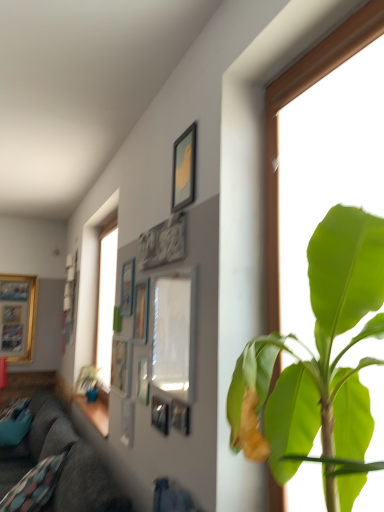
Question: Is matte silver picture frame at center, the sixth picture frame positioned from the front, taller than matte silver picture frame at center, the ninth picture frame in the front-to-back sequence?

Choices:
 (A) yes
 (B) no

Answer: (B)

Question: Is matte silver picture frame at center, the 7th picture frame from the back, placed right next to matte silver picture frame at center, the ninth picture frame in the front-to-back sequence?

Choices:
 (A) no
 (B) yes

Answer: (A)

Question: Is matte silver picture frame at center, the sixth picture frame positioned from the front, far from matte silver picture frame at center, the 4th picture frame from the back?

Choices:
 (A) no
 (B) yes

Answer: (A)

Question: From the image's perspective, is matte silver picture frame at center, the 6th picture frame positioned from the right, over matte silver picture frame at center, the third picture frame from the left?

Choices:
 (A) no
 (B) yes

Answer: (B)

Question: From a real-world perspective, is matte silver picture frame at center, the 6th picture frame positioned from the right, on top of matte silver picture frame at center, the ninth picture frame in the front-to-back sequence?

Choices:
 (A) no
 (B) yes

Answer: (A)

Question: Is matte white picture frame at center, acting as the 1th picture frame starting from the front, spatially inside matte silver picture frame at center, the 6th picture frame positioned from the right, or outside of it?

Choices:
 (A) inside
 (B) outside

Answer: (B)

Question: Is matte white picture frame at center, acting as the 12th picture frame starting from the back, bigger or smaller than matte silver picture frame at center, the 6th picture frame positioned from the right?

Choices:
 (A) small
 (B) big

Answer: (B)

Question: Is matte white picture frame at center, acting as the 1th picture frame starting from the front, wider or thinner than matte silver picture frame at center, the 6th picture frame positioned from the right?

Choices:
 (A) thin
 (B) wide

Answer: (B)

Question: From the image's perspective, is matte white picture frame at center, which is the third picture frame in right-to-left order, located above or below matte silver picture frame at center, the 7th picture frame from the back?

Choices:
 (A) below
 (B) above

Answer: (B)

Question: Relative to dark gray fabric couch at lower left, is gray stone carving at upper center, which is the ninth picture frame in back-to-front order, in front or behind?

Choices:
 (A) front
 (B) behind

Answer: (A)

Question: In terms of width, does gray stone carving at upper center, marked as the eighth picture frame in a left-to-right arrangement, look wider or thinner when compared to dark gray fabric couch at lower left?

Choices:
 (A) wide
 (B) thin

Answer: (B)

Question: In terms of height, does gray stone carving at upper center, which is the ninth picture frame in back-to-front order, look taller or shorter compared to dark gray fabric couch at lower left?

Choices:
 (A) short
 (B) tall

Answer: (A)

Question: From a real-world perspective, is gray stone carving at upper center, which is the ninth picture frame in back-to-front order, physically located above or below dark gray fabric couch at lower left?

Choices:
 (A) above
 (B) below

Answer: (A)

Question: Would you say metallic silver picture frame at upper center, the 11th picture frame viewed from the back, is inside or outside matte wooden picture frame at upper center, the tenth picture frame positioned from the back?

Choices:
 (A) outside
 (B) inside

Answer: (A)

Question: From the image's perspective, is metallic silver picture frame at upper center, which is the 2th picture frame in front-to-back order, positioned above or below matte wooden picture frame at upper center, the third picture frame positioned from the front?

Choices:
 (A) below
 (B) above

Answer: (A)